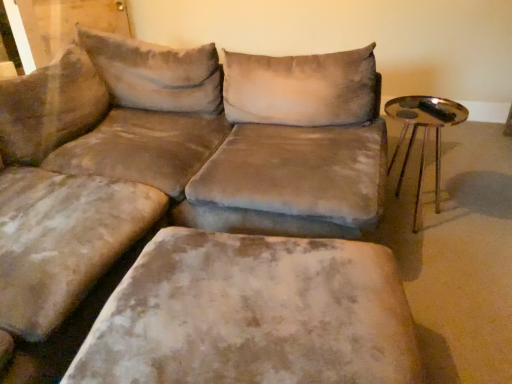
Question: Can you confirm if shiny metallic tray at right is wider than velvet beige ottoman at lower center?

Choices:
 (A) no
 (B) yes

Answer: (A)

Question: Would you say shiny metallic tray at right is a long distance from velvet beige ottoman at lower center?

Choices:
 (A) no
 (B) yes

Answer: (B)

Question: Does shiny metallic tray at right have a greater height compared to velvet beige ottoman at lower center?

Choices:
 (A) no
 (B) yes

Answer: (B)

Question: From a real-world perspective, is shiny metallic tray at right positioned over velvet beige ottoman at lower center based on gravity?

Choices:
 (A) no
 (B) yes

Answer: (B)

Question: Is shiny metallic tray at right further to camera compared to velvet beige ottoman at lower center?

Choices:
 (A) yes
 (B) no

Answer: (A)

Question: Is velvet beige ottoman at lower center inside shiny metallic tray at right?

Choices:
 (A) no
 (B) yes

Answer: (A)

Question: From the image's perspective, is velvet beige ottoman at lower center below shiny metallic tray at right?

Choices:
 (A) no
 (B) yes

Answer: (B)

Question: Is velvet beige ottoman at lower center facing towards shiny metallic tray at right?

Choices:
 (A) yes
 (B) no

Answer: (B)

Question: From a real-world perspective, is velvet beige ottoman at lower center on top of shiny metallic tray at right?

Choices:
 (A) no
 (B) yes

Answer: (A)

Question: Does velvet beige ottoman at lower center have a lesser height compared to shiny metallic tray at right?

Choices:
 (A) no
 (B) yes

Answer: (B)

Question: Is velvet beige ottoman at lower center wider than shiny metallic tray at right?

Choices:
 (A) no
 (B) yes

Answer: (B)

Question: Is velvet beige ottoman at lower center at the right side of shiny metallic tray at right?

Choices:
 (A) yes
 (B) no

Answer: (B)

Question: From a real-world perspective, relative to shiny metallic tray at right, is velvet beige ottoman at lower center vertically above or below?

Choices:
 (A) below
 (B) above

Answer: (A)